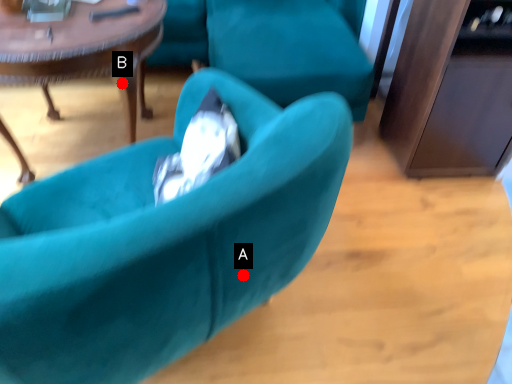
Question: Two points are circled on the image, labeled by A and B beside each circle. Which point is closer to the camera taking this photo?

Choices:
 (A) A is closer
 (B) B is closer

Answer: (A)